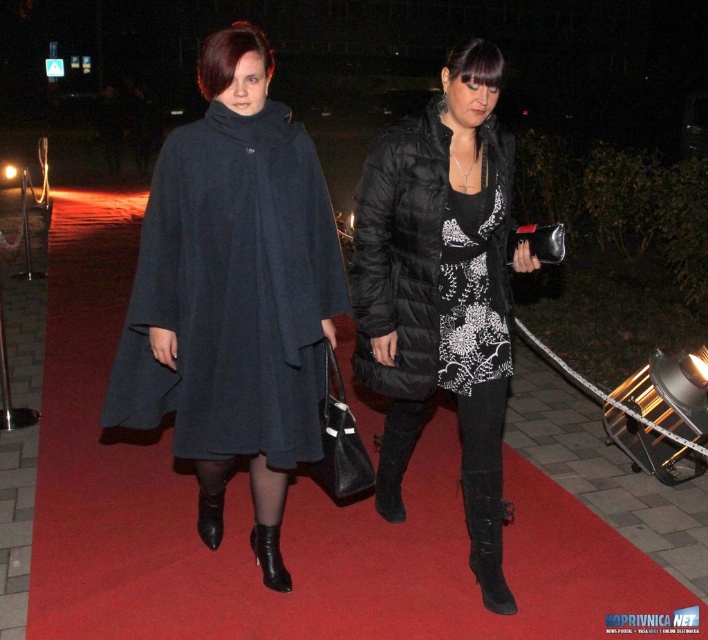
Is matte black cape at center below black suede boot at lower center?

Incorrect, matte black cape at center is not positioned below black suede boot at lower center.

Which is in front, point (198, 173) or point (285, 570)?

Positioned in front is point (198, 173).

Where is `matte black cape at center`? Image resolution: width=708 pixels, height=640 pixels. matte black cape at center is located at coordinates (234, 284).

This screenshot has width=708, height=640. Describe the element at coordinates (473, 285) in the screenshot. I see `black printed dress at center` at that location.

Does black printed dress at center have a lesser height compared to black leather boot at lower center?

No, black printed dress at center is not shorter than black leather boot at lower center.

I want to click on black printed dress at center, so 473,285.

Between matte black coat at center and black leather boot at lower center, which one appears on the left side from the viewer's perspective?

From the viewer's perspective, black leather boot at lower center appears more on the left side.

Does point (435, 348) come farther from viewer compared to point (215, 509)?

No.

This screenshot has height=640, width=708. What are the coordinates of `matte black coat at center` in the screenshot? It's located at (399, 252).